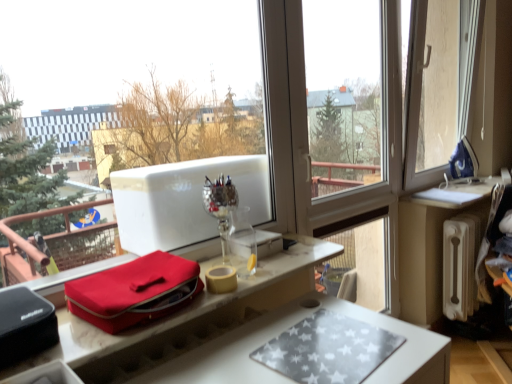
Question: Is silver reflective wine glass at center oriented away from matte red bag at center?

Choices:
 (A) no
 (B) yes

Answer: (A)

Question: Can you confirm if silver reflective wine glass at center is taller than matte red bag at center?

Choices:
 (A) yes
 (B) no

Answer: (A)

Question: From the image's perspective, does silver reflective wine glass at center appear lower than matte red bag at center?

Choices:
 (A) yes
 (B) no

Answer: (B)

Question: Can you confirm if silver reflective wine glass at center is wider than matte red bag at center?

Choices:
 (A) yes
 (B) no

Answer: (B)

Question: From the image's perspective, is silver reflective wine glass at center above matte red bag at center?

Choices:
 (A) no
 (B) yes

Answer: (B)

Question: Is the depth of silver reflective wine glass at center less than that of matte red bag at center?

Choices:
 (A) yes
 (B) no

Answer: (B)

Question: Is white radiator at right positioned behind matte red bag at center?

Choices:
 (A) yes
 (B) no

Answer: (A)

Question: Can you confirm if white radiator at right is positioned to the right of matte red bag at center?

Choices:
 (A) no
 (B) yes

Answer: (B)

Question: Is white radiator at right facing towards matte red bag at center?

Choices:
 (A) yes
 (B) no

Answer: (B)

Question: Considering the relative sizes of white radiator at right and matte red bag at center in the image provided, is white radiator at right wider than matte red bag at center?

Choices:
 (A) yes
 (B) no

Answer: (B)

Question: Can you confirm if white radiator at right is positioned to the left of matte red bag at center?

Choices:
 (A) yes
 (B) no

Answer: (B)

Question: Is white radiator at right turned away from matte red bag at center?

Choices:
 (A) no
 (B) yes

Answer: (A)

Question: Can you confirm if white radiator at right is thinner than silver reflective wine glass at center?

Choices:
 (A) yes
 (B) no

Answer: (B)